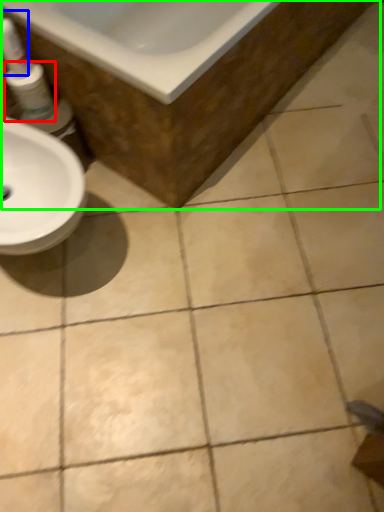
Question: Estimate the real-world distances between objects in this image. Which object is closer to mouthwash (highlighted by a red box), cleaning product (highlighted by a blue box) or bath (highlighted by a green box)?

Choices:
 (A) cleaning product
 (B) bath

Answer: (A)